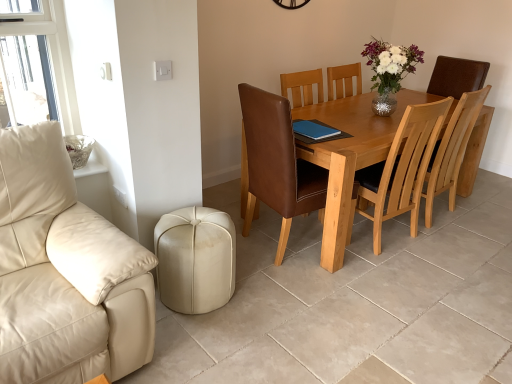
What are the coordinates of `vacant area that is in front of light brown wooden table at center` in the screenshot? It's located at (409, 292).